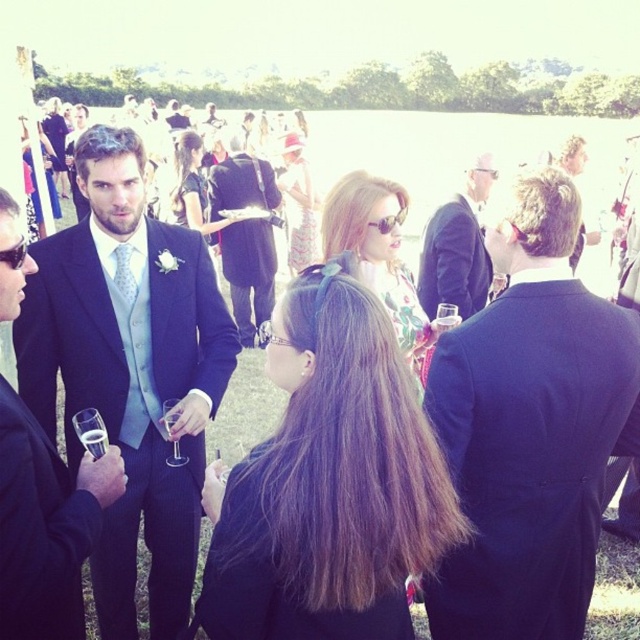
Between brown hair at center and clear glass wine at center, which one is positioned lower?

clear glass wine at center

Can you confirm if brown hair at center is wider than clear glass wine at center?

Indeed, brown hair at center has a greater width compared to clear glass wine at center.

Between point (304, 339) and point (90, 442), which one is positioned in front?

Point (304, 339)

The width and height of the screenshot is (640, 640). Find the location of `brown hair at center`. brown hair at center is located at coordinates (332, 484).

From the picture: Between black suit at center and matte black dress at center, which one appears on the right side from the viewer's perspective?

From the viewer's perspective, black suit at center appears more on the right side.

Is point (472, 477) farther from camera compared to point (196, 205)?

No, (472, 477) is in front of (196, 205).

Is point (460, 416) closer to viewer compared to point (192, 179)?

Yes.

Where is `black suit at center`? black suit at center is located at coordinates (531, 426).

Can you confirm if matte black dress at center is smaller than clear glass wine glass at center?

Actually, matte black dress at center might be larger than clear glass wine glass at center.

Measure the distance between point (198,161) and camera.

Point (198,161) is 8.82 meters from camera.

Find the location of `matte black dress at center`. matte black dress at center is located at coordinates (193, 188).